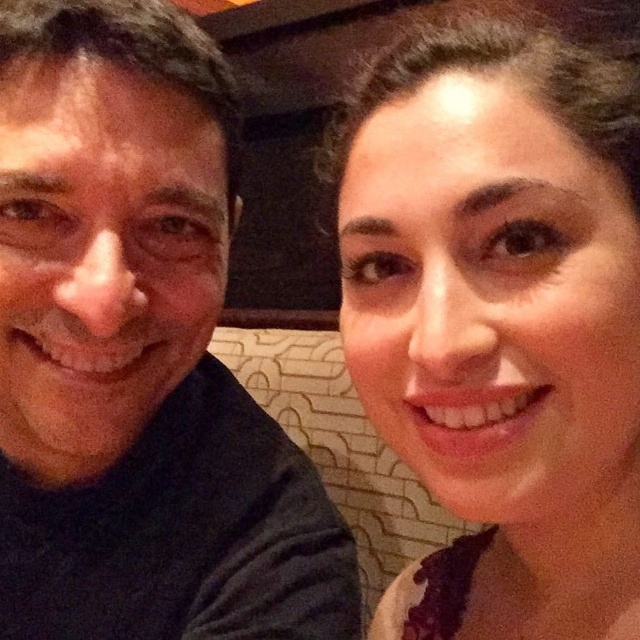
You are a photographer trying to capture a closeup of the man and the woman in the scene. You notice two points marked in the image at coordinates point [157,388] and point [618,612]. Which point is closer to you, the photographer?

Point [157,388] is further to the viewer than point [618,612], so the point closer to you is point [618,612].